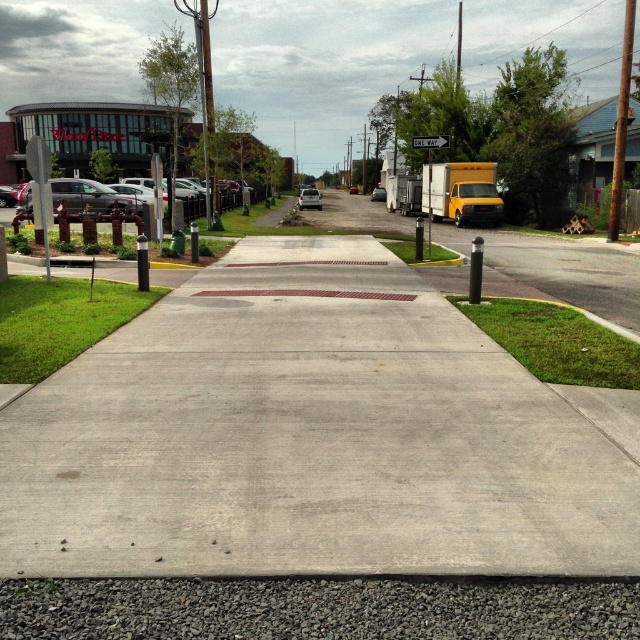
Question: Which point is farther to the camera?

Choices:
 (A) (20, 211)
 (B) (186, 451)
 (C) (316, 192)
 (D) (474, 179)

Answer: (C)

Question: Which point appears farthest from the camera in this image?

Choices:
 (A) (486, 166)
 (B) (385, 196)
 (C) (225, 193)
 (D) (385, 445)

Answer: (B)

Question: Which of the following is the closest to the observer?

Choices:
 (A) yellow matte truck at right
 (B) silver metallic sedan at center
 (C) silver metallic sedan at center-left

Answer: (C)

Question: Does yellow matte truck at right have a greater width compared to matte white truck at center?

Choices:
 (A) no
 (B) yes

Answer: (B)

Question: Can you confirm if gray concrete sidewalk at center is smaller than yellow matte truck at right?

Choices:
 (A) no
 (B) yes

Answer: (B)

Question: Can you confirm if yellow matte truck at right is positioned above silver metallic sedan at center?

Choices:
 (A) no
 (B) yes

Answer: (A)